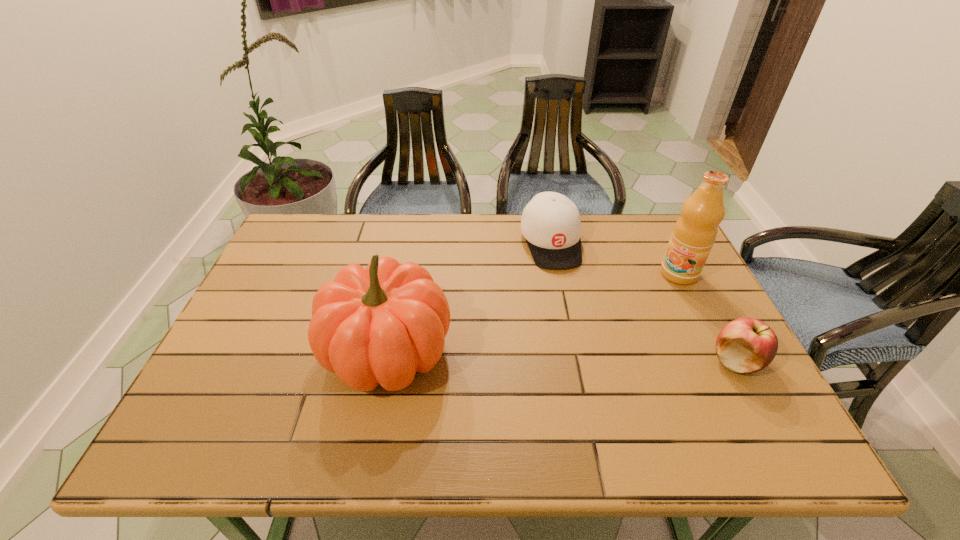
I want to click on empty space that is in between the second object from left to right and the apple, so click(x=643, y=302).

Locate an element on the screen. The width and height of the screenshot is (960, 540). vacant area that lies between the leftmost object and the apple is located at coordinates (562, 356).

The width and height of the screenshot is (960, 540). What are the coordinates of `free spot between the apple and the pumpkin` in the screenshot? It's located at (562, 356).

Locate an element on the screen. free space between the leftmost object and the apple is located at coordinates (562, 356).

Find the location of a particular element. the second closest object relative to the third object from right to left is located at coordinates (380, 325).

Locate which object ranks third in proximity to the apple. Please provide its 2D coordinates. Your answer should be formatted as a tuple, i.e. [(x, y)], where the tuple contains the x and y coordinates of a point satisfying the conditions above.

[(380, 325)]

The image size is (960, 540). Find the location of `vacant space that satisfies the following two spatial constraints: 1. on the front side of the pumpkin; 2. on the bitten side of the apple`. vacant space that satisfies the following two spatial constraints: 1. on the front side of the pumpkin; 2. on the bitten side of the apple is located at coordinates (386, 361).

I want to click on blank space that satisfies the following two spatial constraints: 1. on the front side of the fruit juice; 2. on the bitten side of the apple, so click(723, 361).

The width and height of the screenshot is (960, 540). I want to click on vacant space that satisfies the following two spatial constraints: 1. on the front side of the apple; 2. on the bitten side of the fruit juice, so click(x=723, y=361).